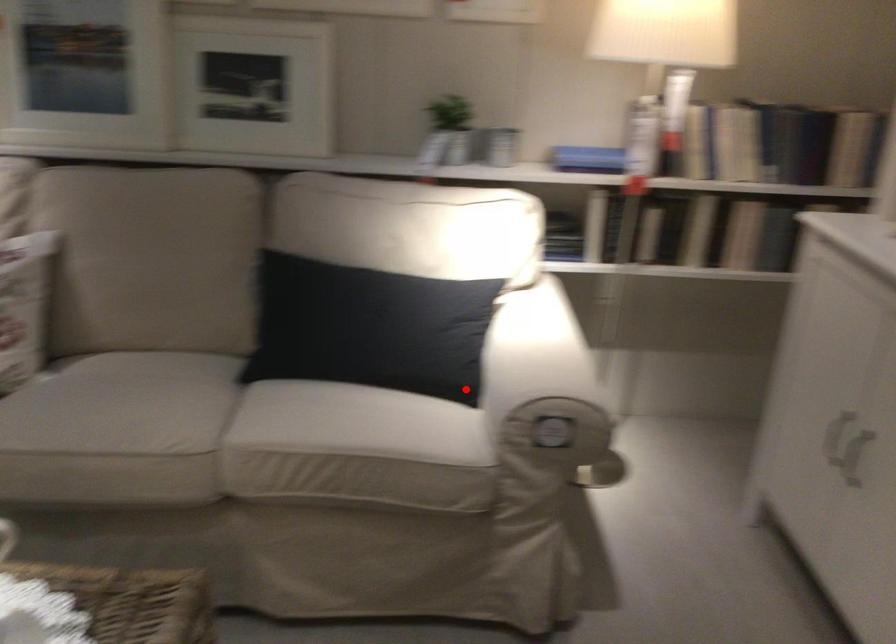
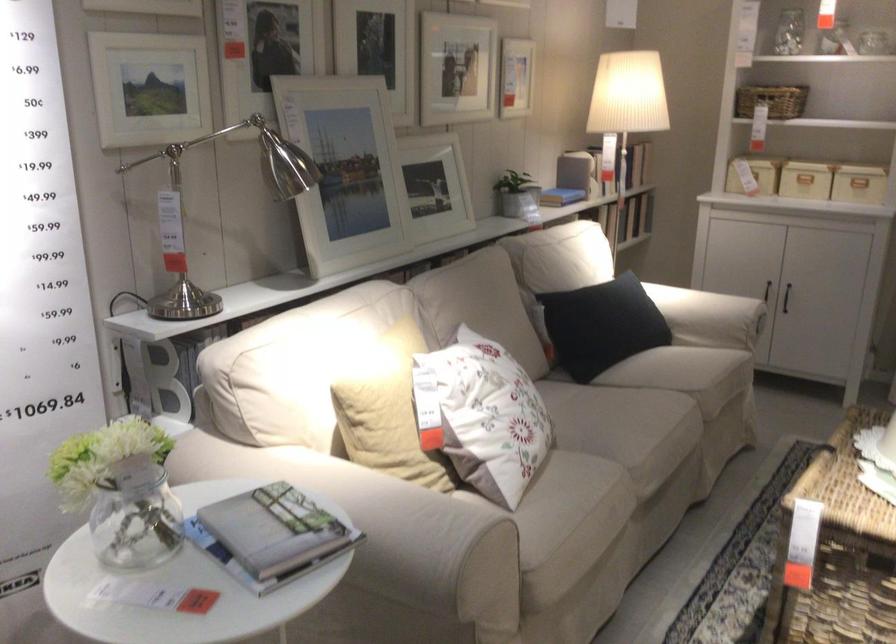
Locate, in the second image, the point that corresponds to the highlighted location in the first image.

(709, 317)